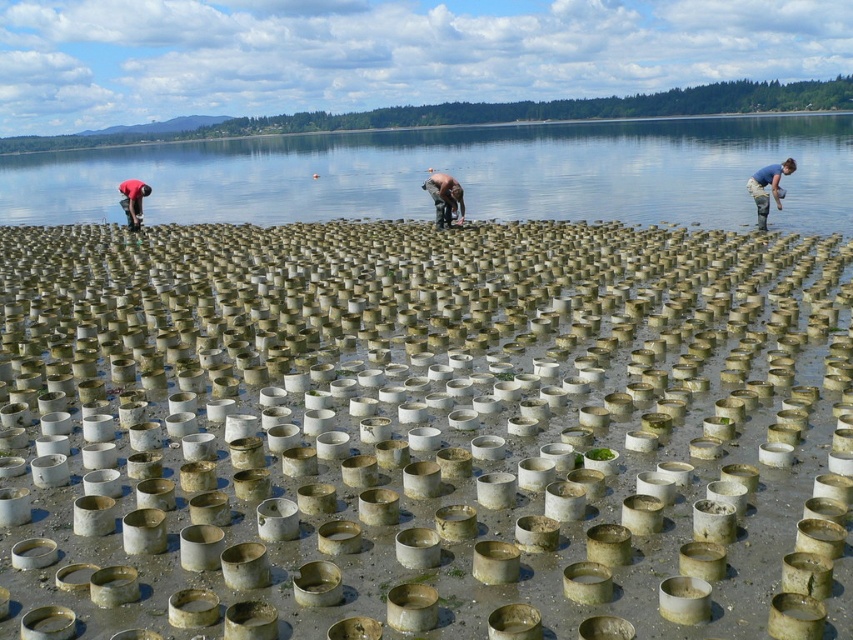
Question: Can you confirm if greenish-gray concrete cylinders at center is positioned below green algae-covered rocks at center?

Choices:
 (A) no
 (B) yes

Answer: (B)

Question: Is green algae-covered rocks at center thinner than red fabric shirt at left?

Choices:
 (A) no
 (B) yes

Answer: (A)

Question: Which object appears farthest from the camera in this image?

Choices:
 (A) green algae-covered rocks at center
 (B) red fabric shirt at left
 (C) blue rubber boot at lower right
 (D) greenish-gray concrete cylinders at center

Answer: (B)

Question: Is greenish-gray concrete cylinders at center positioned in front of brown leather jacket at center?

Choices:
 (A) no
 (B) yes

Answer: (B)

Question: Estimate the real-world distances between objects in this image. Which object is farther from the green algae-covered rocks at center?

Choices:
 (A) brown leather jacket at center
 (B) blue rubber boot at lower right
 (C) greenish-gray concrete cylinders at center
 (D) red fabric shirt at left

Answer: (A)

Question: Which object is closer to the camera taking this photo?

Choices:
 (A) brown leather jacket at center
 (B) blue rubber boot at lower right

Answer: (B)